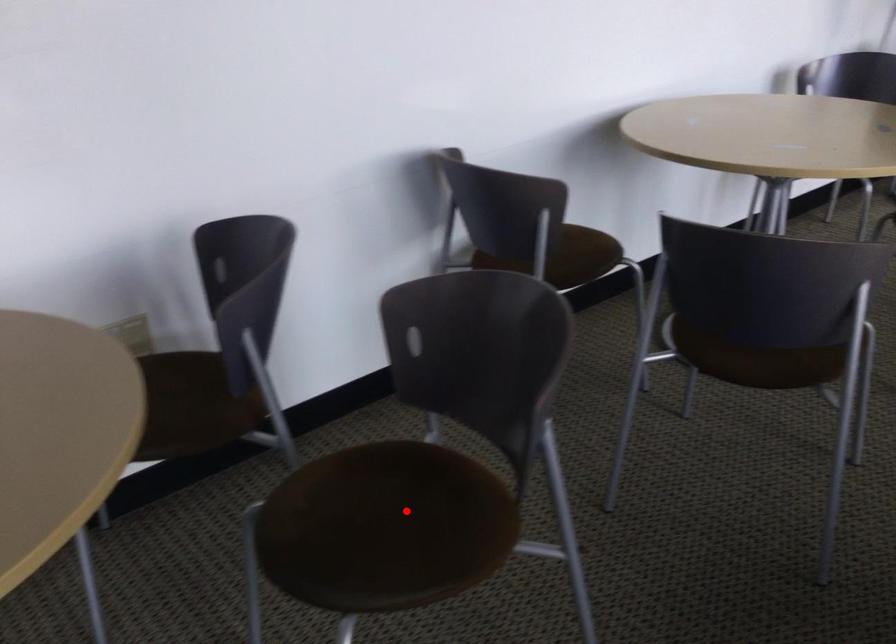
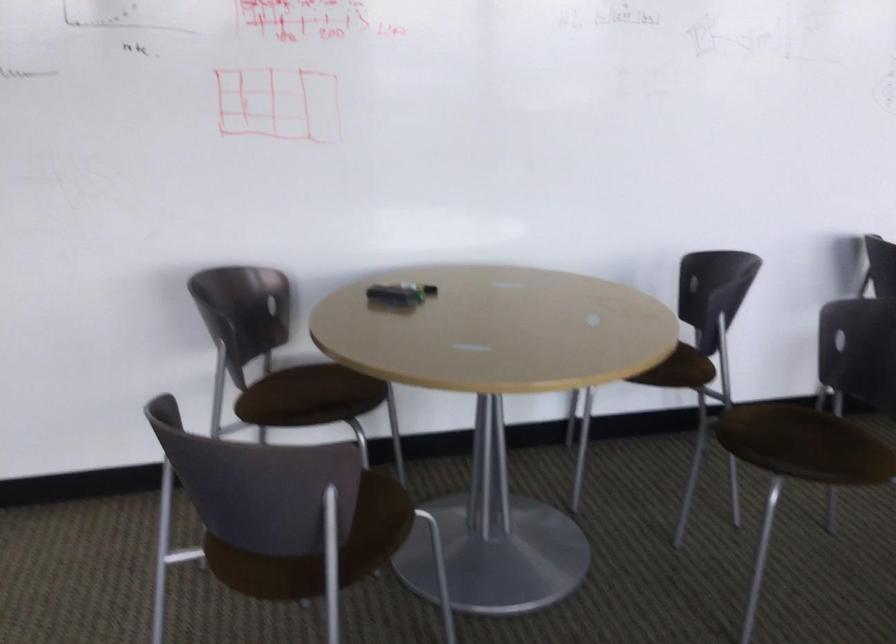
The point at the highlighted location is marked in the first image. Where is the corresponding point in the second image?

(798, 437)